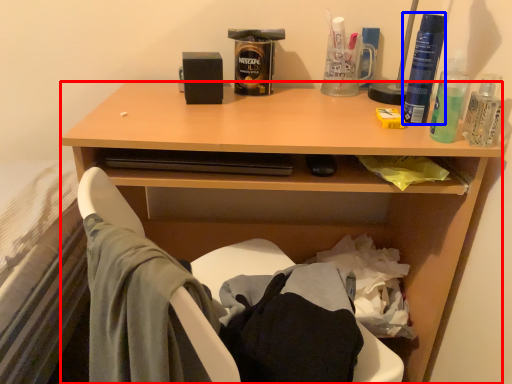
Question: Which point is closer to the camera, desk (highlighted by a red box) or bottle (highlighted by a blue box)?

Choices:
 (A) desk
 (B) bottle

Answer: (A)